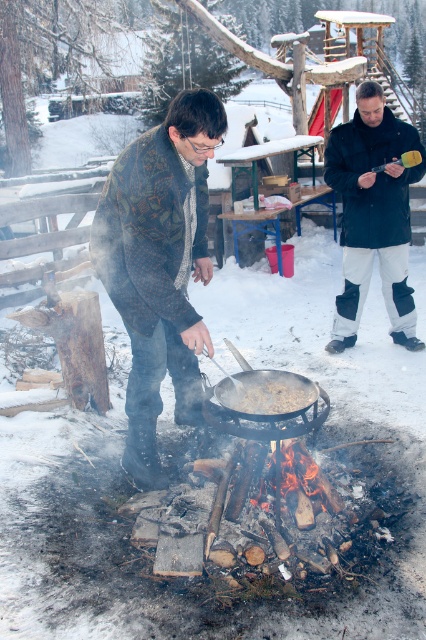
You are a photographer trying to capture both the dark blue jacket at center and the brown matte pan at center in a single shot. Based on their sizes, which object will appear bigger in the photo?

The dark blue jacket at center will appear bigger in the photo since it has a larger size compared to the brown matte pan at center according to the description.

You are a photographer standing 5 feet away from the knitted sweater at center. You want to take a photo of the camera that is 8.02 feet away from the sweater. Can you reach the camera without moving from your current position?

The camera is 8.02 feet away from the knitted sweater at center. Since you are 5 feet away from the sweater, the total distance to the camera is 8.02 feet. If your reach extends beyond 3.02 feet, you might be able to reach it, but typically, human reach is about 3 feet. Therefore, you would need to move closer to the camera to take the photo.

You are standing in the snowy area and want to hand a tool to the person wearing the dark blue jacket at center. Which direction should you move relative to the brown matte pan at center?

The dark blue jacket at center is positioned on the right side of the brown matte pan at center, so you should move to the right of the brown matte pan at center to reach the dark blue jacket at center.